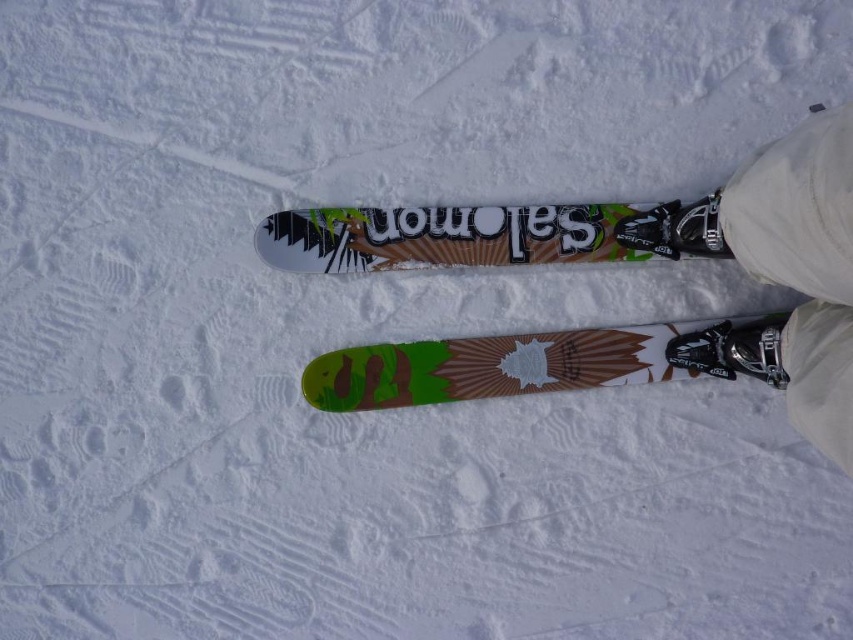
You are a ski boot salesman and a customer wants to know which boot is bigger between the metallic silver ski boot at lower right and the matte black ski boot at center. Which one do you recommend?

The metallic silver ski boot at lower right is larger in size compared to the matte black ski boot at center, so I would recommend the metallic silver ski boot at lower right if the customer needs a bigger size.

You are standing at the starting point of a ski slope and see two points marked on the snow. The first point is labeled as point (709, 356) and the second point is labeled as point (618, 234). Which point is closer to the bottom of the slope?

Point (709, 356) is in front of point (618, 234), so it is closer to the bottom of the slope.

You are standing on a snowy slope and see the white fabric pants at lower right and the green matte snowboard at center. Which object is taller from your perspective?

The white fabric pants at lower right is much taller than the green matte snowboard at center.